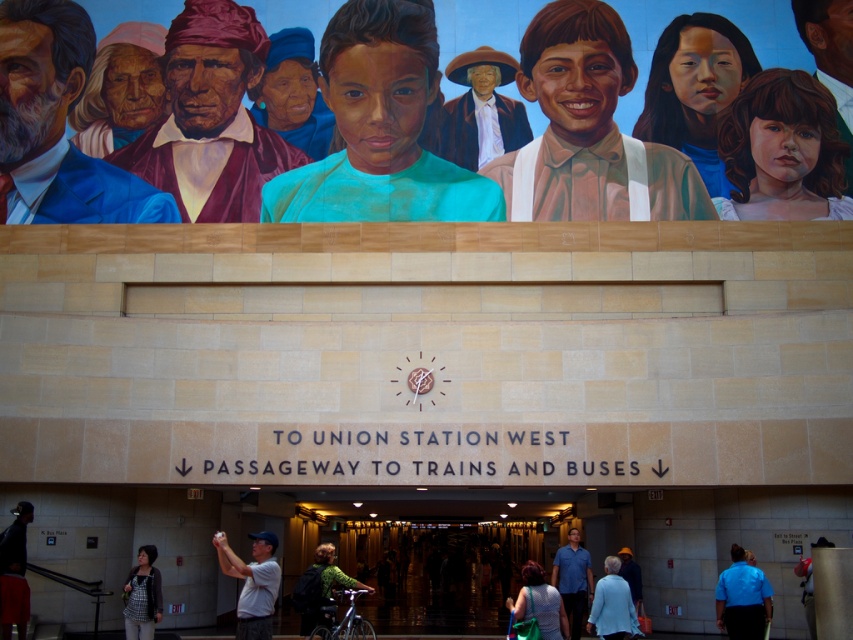
You are standing at the entrance of Union Station West and notice two blue items. The first is a matte blue suit at upper left and the second is a blue cotton shirt at center. Which of these two items is closer to you?

The matte blue suit at upper left is closer to you because the blue cotton shirt at center is behind it.

You are standing at the entrance of Union Station West and notice two shirts displayed on a rack between the sign and the clock. The teal matte shirt at center and the blue cotton shirt at center. Which shirt is positioned higher on the rack?

The teal matte shirt at center is positioned higher than the blue cotton shirt at center on the rack.

You are an artist observing the entrance to Union Station West. You notice two blue items in the scene. Which one is bigger? The matte blue suit at upper left or the blue cotton shirt at center?

The matte blue suit at upper left is larger in size compared to the blue cotton shirt at center.